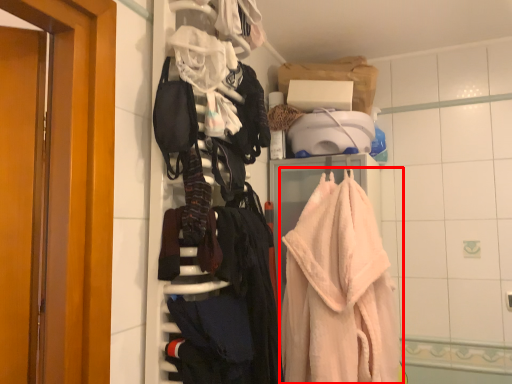
Question: From the image's perspective, where is towel (annotated by the red box) located relative to clothing?

Choices:
 (A) below
 (B) above

Answer: (B)